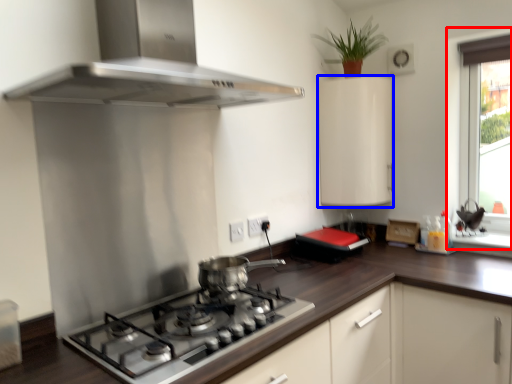
Question: Among these objects, which one is farthest to the camera, window (highlighted by a red box) or cabinetry (highlighted by a blue box)?

Choices:
 (A) window
 (B) cabinetry

Answer: (B)